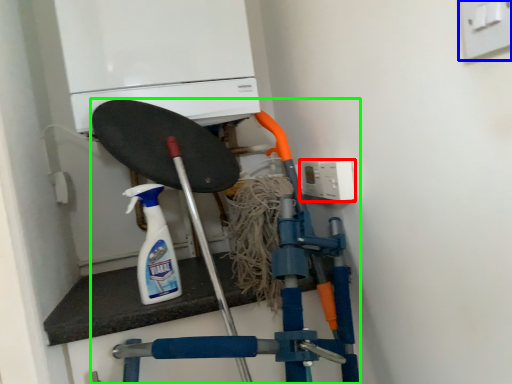
Question: Which is farther away from electric outlet (highlighted by a red box)? electric outlet (highlighted by a blue box) or vacuum (highlighted by a green box)?

Choices:
 (A) electric outlet
 (B) vacuum

Answer: (A)